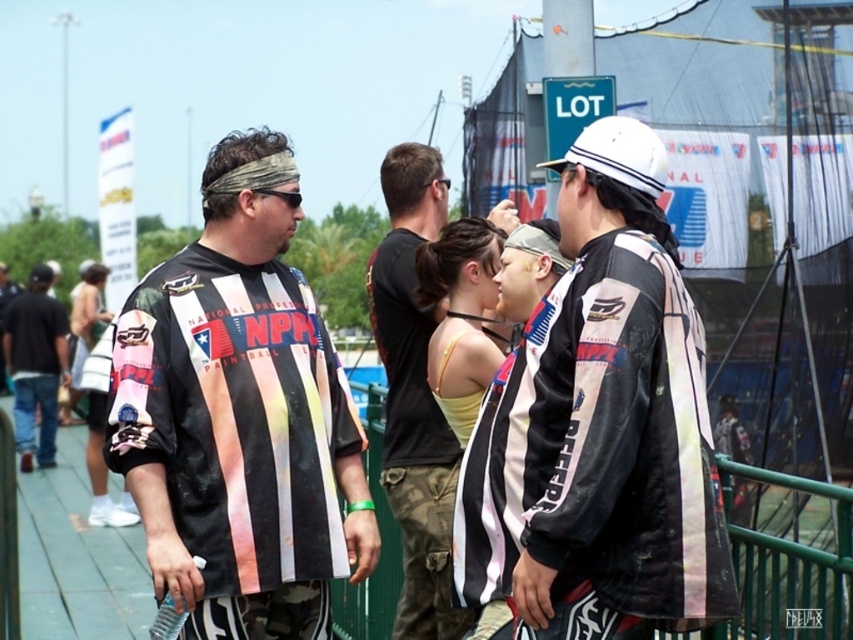
Based on the photo, you are organizing a photo shoot and need to ensure that the printed jersey at center and the matte black jacket at center can fit side by side on a 1.2 meter wide backdrop. Based on the scene description, can they both fit comfortably?

The printed jersey at center might be wider than matte black jacket at center, so it is uncertain if they can fit side by side on a 1.2 meter wide backdrop without overlapping or crowding.

You are organizing a photoshoot and need to ensure that the yellow fabric top at center and the matte black jacket at center are visible in the frame. Based on their sizes, which one should you focus on first to ensure it fits within the camera frame?

The yellow fabric top at center has a larger size compared to the matte black jacket at center, so you should focus on ensuring the yellow fabric top at center fits first to accommodate its larger size.